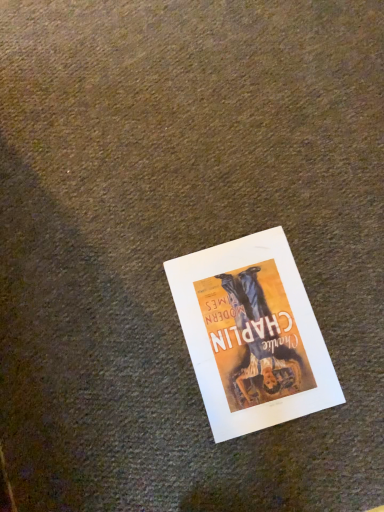
Locate an element on the screen. white paper poster at center is located at coordinates (252, 335).

This screenshot has width=384, height=512. Describe the element at coordinates (252, 335) in the screenshot. I see `white paper poster at center` at that location.

What is the approximate height of white paper poster at center?

white paper poster at center is 0.64 inches tall.

Where is `white paper poster at center`? white paper poster at center is located at coordinates (252, 335).